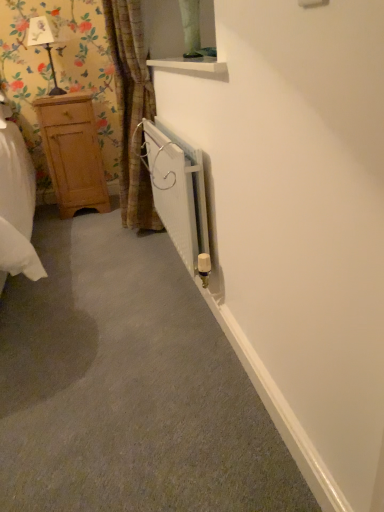
You are a GUI agent. You are given a task and a screenshot of the screen. Output one action in this format:
    pyautogui.click(x=<x>, y=<y>)
    Task: Click on the white metallic radiator at center
    This screenshot has width=384, height=512.
    Given the screenshot: What is the action you would take?
    pyautogui.click(x=180, y=197)

Measure the distance between point (32, 45) and camera.

The depth of point (32, 45) is 9.19 feet.

At what (x,y) coordinates should I click in order to perform the action: click on white metallic radiator at center. Please return your answer as a coordinate pair (x, y). Looking at the image, I should click on (180, 197).

Who is bigger, white metallic radiator at center or matte black lamp at upper left?

white metallic radiator at center.

What's the angular difference between white metallic radiator at center and matte black lamp at upper left's facing directions?

61.2 degrees.

Between white metallic radiator at center and matte black lamp at upper left, which one is positioned in front?

white metallic radiator at center is in front.

Is white metallic radiator at center positioned beyond the bounds of matte black lamp at upper left?

Yes, white metallic radiator at center is located beyond the bounds of matte black lamp at upper left.

Who is more distant, light brown wooden dresser at left or matte black lamp at upper left?

light brown wooden dresser at left is further from the camera.

Which object is positioned more to the left, light brown wooden dresser at left or matte black lamp at upper left?

matte black lamp at upper left is more to the left.

Is light brown wooden dresser at left located outside matte black lamp at upper left?

Absolutely, light brown wooden dresser at left is external to matte black lamp at upper left.

Can you confirm if light brown wooden dresser at left is wider than matte black lamp at upper left?

Indeed, light brown wooden dresser at left has a greater width compared to matte black lamp at upper left.

You are a GUI agent. You are given a task and a screenshot of the screen. Output one action in this format:
    pyautogui.click(x=<x>, y=<y>)
    Task: Click on the curtain lying above the white metallic radiator at center (from the image's perspective)
    Image resolution: width=384 pixels, height=512 pixels.
    Given the screenshot: What is the action you would take?
    pyautogui.click(x=132, y=111)

Which object is positioned more to the right, brown textured curtain at left or white metallic radiator at center?

From the viewer's perspective, white metallic radiator at center appears more on the right side.

In the scene shown: Does brown textured curtain at left come behind white metallic radiator at center?

Yes.

Could you tell me if brown textured curtain at left is facing white metallic radiator at center?

No, brown textured curtain at left is not facing towards white metallic radiator at center.

Which object is positioned more to the right, light brown wooden dresser at left or white metallic radiator at center?

From the viewer's perspective, white metallic radiator at center appears more on the right side.

From the picture: Who is bigger, light brown wooden dresser at left or white metallic radiator at center?

Bigger between the two is light brown wooden dresser at left.

Is light brown wooden dresser at left shorter than white metallic radiator at center?

No.

Is light brown wooden dresser at left outside of white metallic radiator at center?

Yes.

Which object is positioned more to the right, white metallic radiator at center or brown textured curtain at left?

white metallic radiator at center is more to the right.

Is white metallic radiator at center in contact with brown textured curtain at left?

white metallic radiator at center and brown textured curtain at left are clearly separated.

Which is in front, white metallic radiator at center or brown textured curtain at left?

white metallic radiator at center is closer to the camera.

From the image's perspective, relative to brown textured curtain at left, is white metallic radiator at center above or below?

Clearly, from the image's perspective, white metallic radiator at center is below brown textured curtain at left.

In the image, is white metallic radiator at center positioned in front of or behind light brown wooden dresser at left?

Clearly, white metallic radiator at center is in front of light brown wooden dresser at left.

Is white metallic radiator at center touching light brown wooden dresser at left?

No, white metallic radiator at center is not touching light brown wooden dresser at left.

Is white metallic radiator at center completely or partially outside of light brown wooden dresser at left?

white metallic radiator at center lies outside light brown wooden dresser at left's area.

From the image's perspective, which object appears higher, white metallic radiator at center or light brown wooden dresser at left?

light brown wooden dresser at left appears higher in the image.

Are light brown wooden dresser at left and brown textured curtain at left making contact?

No, light brown wooden dresser at left is not with brown textured curtain at left.

Looking at this image, which is behind, light brown wooden dresser at left or brown textured curtain at left?

light brown wooden dresser at left is further from the camera.

Considering the sizes of objects light brown wooden dresser at left and brown textured curtain at left in the image provided, who is bigger, light brown wooden dresser at left or brown textured curtain at left?

brown textured curtain at left is bigger.

Is light brown wooden dresser at left oriented away from brown textured curtain at left?

No, brown textured curtain at left is not at the back of light brown wooden dresser at left.

Image resolution: width=384 pixels, height=512 pixels. In order to click on lamp above the white metallic radiator at center (from a real-world perspective) in this screenshot , I will do `click(44, 44)`.

In the image, there is a matte black lamp at upper left. Identify the location of dresser below it (from a real-world perspective). (73, 153).

Which object lies nearer to the anchor point light brown wooden dresser at left, white metallic radiator at center or matte black lamp at upper left?

Based on the image, matte black lamp at upper left appears to be nearer to light brown wooden dresser at left.

Estimate the real-world distances between objects in this image. Which object is closer to light brown wooden dresser at left, brown textured curtain at left or white metallic radiator at center?

Based on the image, brown textured curtain at left appears to be nearer to light brown wooden dresser at left.

Looking at the image, which one is located closer to matte black lamp at upper left, white metallic radiator at center or light brown wooden dresser at left?

The object closer to matte black lamp at upper left is light brown wooden dresser at left.

Considering their positions, is white metallic radiator at center positioned closer to brown textured curtain at left than matte black lamp at upper left?

Among the two, white metallic radiator at center is located nearer to brown textured curtain at left.

From the image, which object appears to be farther from matte black lamp at upper left, white metallic radiator at center or brown textured curtain at left?

Based on the image, white metallic radiator at center appears to be further to matte black lamp at upper left.

Considering their positions, is white metallic radiator at center positioned further to brown textured curtain at left than light brown wooden dresser at left?

white metallic radiator at center is further to brown textured curtain at left.

Based on their spatial positions, is light brown wooden dresser at left or white metallic radiator at center further from brown textured curtain at left?

Based on the image, white metallic radiator at center appears to be further to brown textured curtain at left.

From the image, which object appears to be nearer to light brown wooden dresser at left, matte black lamp at upper left or brown textured curtain at left?

brown textured curtain at left.

Where is `curtain positioned between white metallic radiator at center and light brown wooden dresser at left from near to far`? The height and width of the screenshot is (512, 384). curtain positioned between white metallic radiator at center and light brown wooden dresser at left from near to far is located at coordinates (132, 111).

Image resolution: width=384 pixels, height=512 pixels. I want to click on lamp positioned between white metallic radiator at center and light brown wooden dresser at left from near to far, so click(44, 44).

The image size is (384, 512). I want to click on lamp between brown textured curtain at left and light brown wooden dresser at left in the front-back direction, so click(44, 44).

Locate an element on the screen. Image resolution: width=384 pixels, height=512 pixels. curtain between white metallic radiator at center and matte black lamp at upper left in the front-back direction is located at coordinates (132, 111).